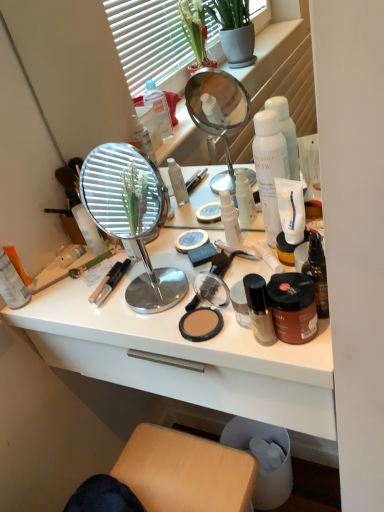
Identify the location of vacant space in between brown matte jar at center-right, which appears as the second toiletry when viewed from the right, and matte black brush at lower left. This screenshot has height=512, width=384. (122, 290).